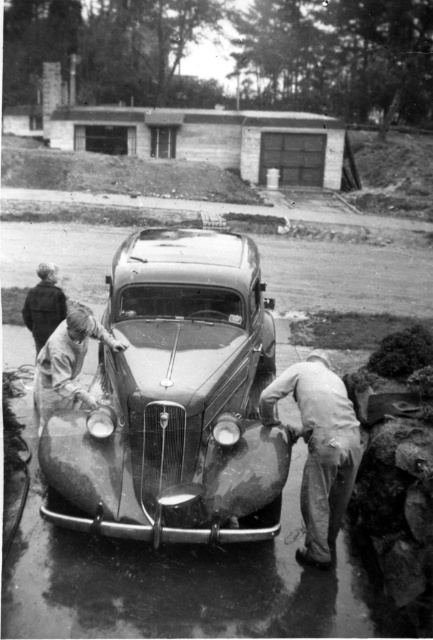
You are a photographer wanting to capture the polished metal car at center and the light brown leather jacket at front center in the same frame. Given that your camera has a fixed focal length, which object should you position closer to the camera to ensure both fit in the frame?

Since the polished metal car at center is wider than the light brown leather jacket at front center, you should position the polished metal car at center closer to the camera. This will help reduce its apparent size so that both objects fit within the frame.